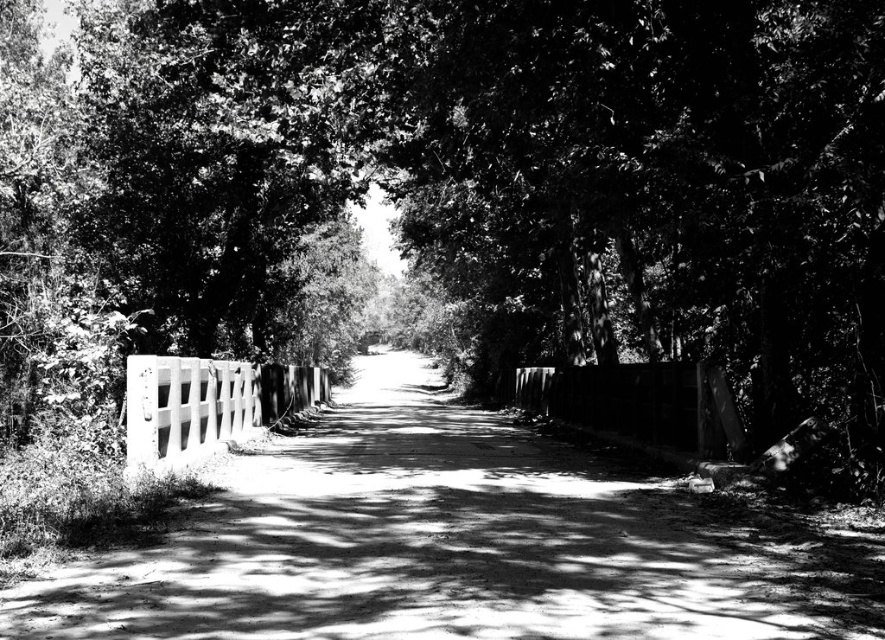
Question: Estimate the real-world distances between objects in this image. Which object is closer to the white wooden fence at left?

Choices:
 (A) smooth wooden fence at center
 (B) smooth concrete fence at left

Answer: (A)

Question: Estimate the real-world distances between objects in this image. Which object is closer to the white wooden fence at left?

Choices:
 (A) smooth concrete fence at left
 (B) smooth wooden fence at center

Answer: (B)

Question: Does white wooden fence at left appear on the right side of smooth concrete fence at left?

Choices:
 (A) yes
 (B) no

Answer: (A)

Question: Which point is closer to the camera?

Choices:
 (A) (633, 420)
 (B) (245, 417)
 (C) (397, 582)

Answer: (C)

Question: Is white wooden fence at left positioned before smooth concrete fence at left?

Choices:
 (A) no
 (B) yes

Answer: (B)

Question: Does white wooden fence at left appear on the right side of smooth wooden fence at center?

Choices:
 (A) yes
 (B) no

Answer: (B)